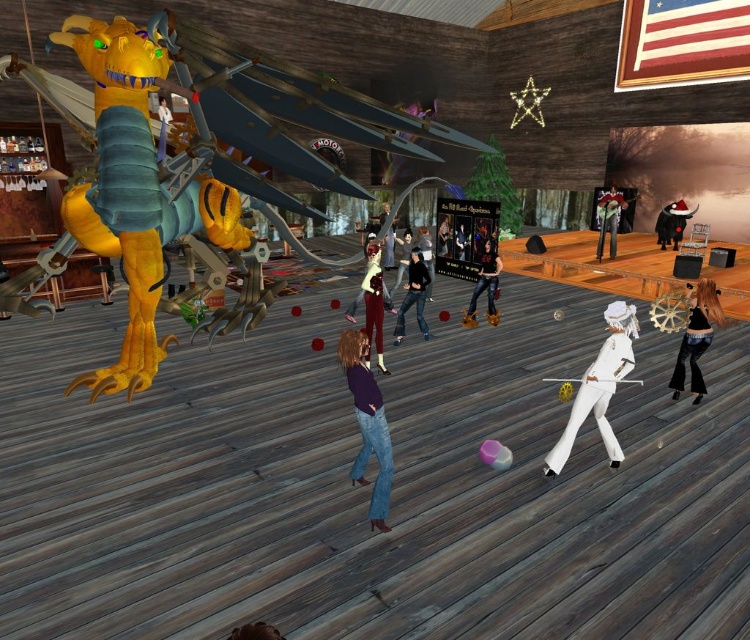
Who is lower down, shiny black hair at center or shiny silver helmet at upper right?

shiny black hair at center

Which is in front, point (692, 340) or point (608, 212)?

Point (692, 340) is more forward.

Locate an element on the screen. This screenshot has height=640, width=750. shiny black hair at center is located at coordinates (696, 337).

Is black santa hat at center wider than black leather jacket at center?

Correct, the width of black santa hat at center exceeds that of black leather jacket at center.

Is point (664, 221) in front of point (430, 260)?

No.

This screenshot has height=640, width=750. What do you see at coordinates (672, 224) in the screenshot?
I see `black santa hat at center` at bounding box center [672, 224].

Find the location of a particular element. black santa hat at center is located at coordinates (672, 224).

Is white glossy hat at center closer to camera compared to smooth black jacket at center?

That is True.

Does point (570, 422) lie in front of point (424, 288)?

Yes, it is.

Is point (579, 406) farther from camera compared to point (400, 304)?

No, it is in front of (400, 304).

The width and height of the screenshot is (750, 640). In order to click on white glossy hat at center in this screenshot , I will do `click(600, 387)`.